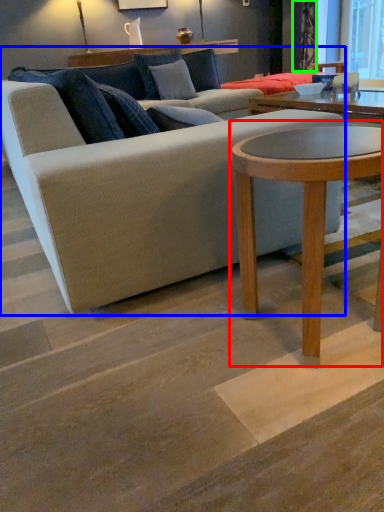
Question: Based on their relative distances, which object is farther from coffee table (highlighted by a red box)? Choose from studio couch (highlighted by a blue box) and curtain (highlighted by a green box).

Choices:
 (A) studio couch
 (B) curtain

Answer: (B)